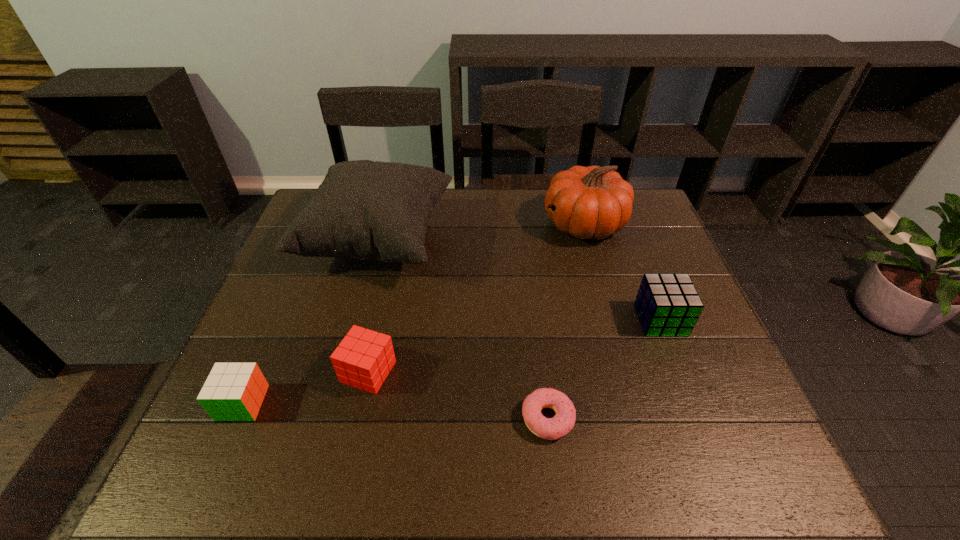
The height and width of the screenshot is (540, 960). In order to click on cushion in this screenshot , I will do `click(366, 210)`.

Where is `pumpkin`? The image size is (960, 540). pumpkin is located at coordinates (593, 202).

At what (x,y) coordinates should I click in order to perform the action: click on the fourth nearest object. Please return your answer as a coordinate pair (x, y). Looking at the image, I should click on click(667, 305).

Find the location of a particular element. Image resolution: width=960 pixels, height=540 pixels. the farthest cube is located at coordinates (667, 305).

The image size is (960, 540). Find the location of `the second cube from right to left`. the second cube from right to left is located at coordinates (363, 360).

Where is `the leftmost cube`? The width and height of the screenshot is (960, 540). the leftmost cube is located at coordinates (233, 391).

Where is `the shortest object`? Image resolution: width=960 pixels, height=540 pixels. the shortest object is located at coordinates (562, 423).

Locate an element on the screen. doughnut is located at coordinates (562, 423).

Locate an element on the screen. vacant space located on the right of the cushion is located at coordinates (558, 240).

The height and width of the screenshot is (540, 960). What are the coordinates of `vacant region located 0.130m on the face of the pumpkin` in the screenshot? It's located at (501, 225).